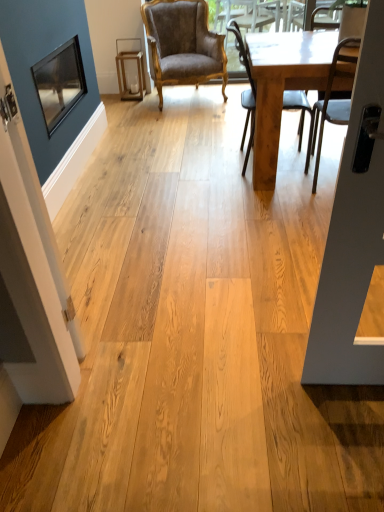
The height and width of the screenshot is (512, 384). In order to click on empty space that is in between light brown wooden table at right and matte black screen door at left in this screenshot , I will do `click(221, 234)`.